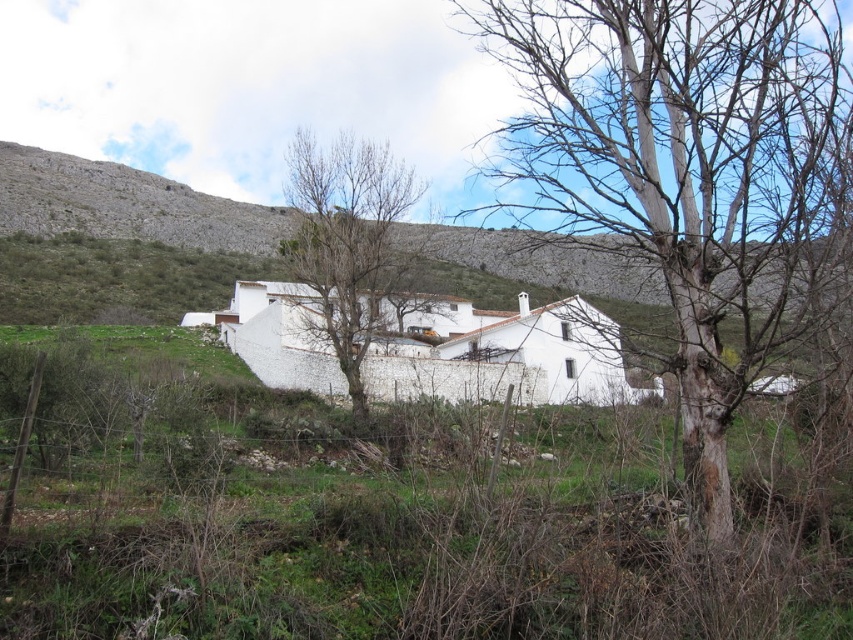
Question: In this image, where is bare wood tree at center located relative to white smooth hillside at center?

Choices:
 (A) left
 (B) right

Answer: (B)

Question: Among these points, which one is nearest to the camera?

Choices:
 (A) (73, 228)
 (B) (524, 173)
 (C) (376, 232)

Answer: (B)

Question: Which object appears farthest from the camera in this image?

Choices:
 (A) bare branches at center
 (B) bare wood tree at center

Answer: (A)

Question: Is white smooth hillside at center smaller than bare branches at center?

Choices:
 (A) no
 (B) yes

Answer: (A)

Question: Which point is farther to the camera?

Choices:
 (A) (357, 202)
 (B) (258, 225)

Answer: (B)

Question: Does bare wood tree at center have a lesser width compared to bare branches at center?

Choices:
 (A) no
 (B) yes

Answer: (A)